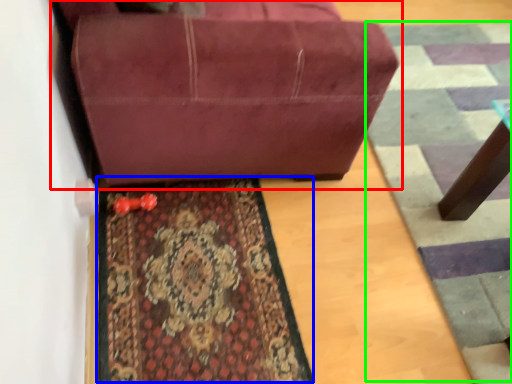
Question: Considering the real-world distances, which object is closest to studio couch (highlighted by a red box)? mat (highlighted by a blue box) or doormat (highlighted by a green box).

Choices:
 (A) mat
 (B) doormat

Answer: (A)